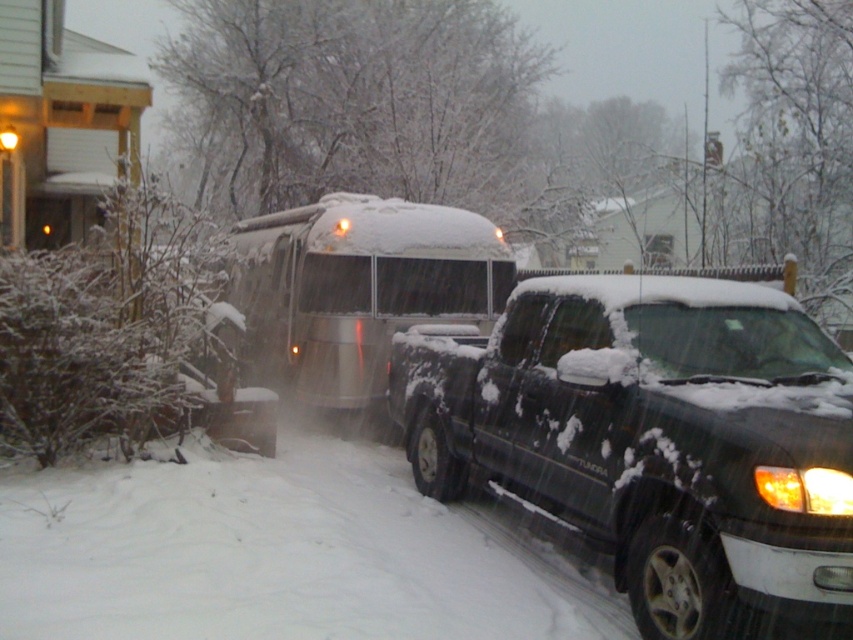
Question: Can you confirm if black matte truck at center is positioned to the left of silver metallic bus at center?

Choices:
 (A) no
 (B) yes

Answer: (A)

Question: Among these points, which one is nearest to the camera?

Choices:
 (A) (454, 298)
 (B) (740, 321)

Answer: (B)

Question: Where is black matte truck at center located in relation to silver metallic bus at center in the image?

Choices:
 (A) above
 (B) below

Answer: (B)

Question: Is black matte truck at center smaller than silver metallic bus at center?

Choices:
 (A) no
 (B) yes

Answer: (A)

Question: Among these objects, which one is farthest from the camera?

Choices:
 (A) black matte truck at center
 (B) silver metallic bus at center

Answer: (B)